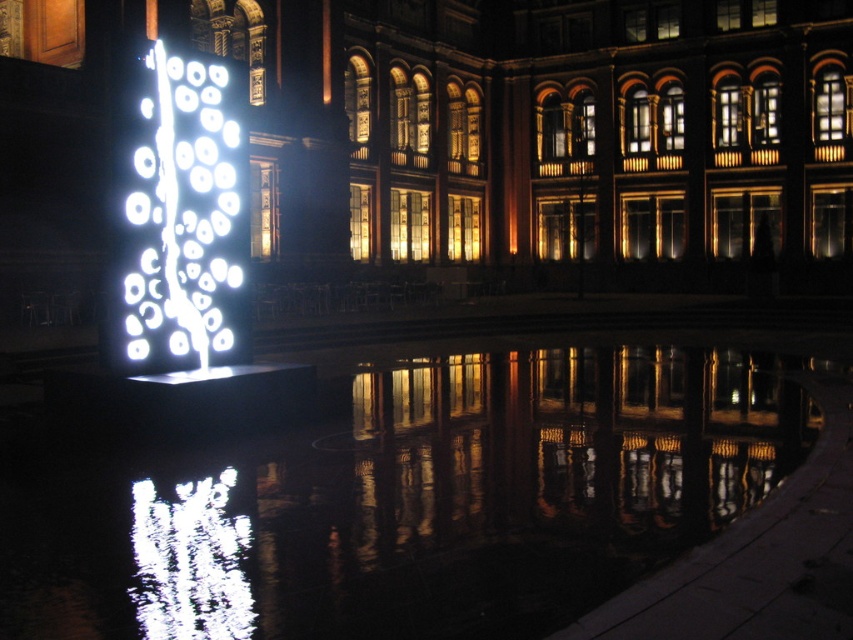
You are standing on the dock and want to pour a bottle of water into the water. Which area would you choose between the transparent liquid water at center and the white glossy water at lower left to avoid splashing? Explain your choice based on their heights.

You should pour the water into the transparent liquid water at center because it has a greater height compared to the white glossy water at lower left, meaning it can accommodate the pouring action without causing splashing as effectively.

You are a boat operator who needs to navigate a narrow boat through the water. The boat requires a minimum width of 3 meters to pass safely. Based on the scene, can you determine if the transparent liquid water at center is wide enough for your boat to pass through compared to the white glossy water at lower left?

The transparent liquid water at center might be wider than white glossy water at lower left. Since the boat requires a minimum of 3 meters, if the transparent liquid water at center is indeed wider, it could accommodate the boat. However, without exact measurements, it is uncertain. Please verify the width before proceeding.